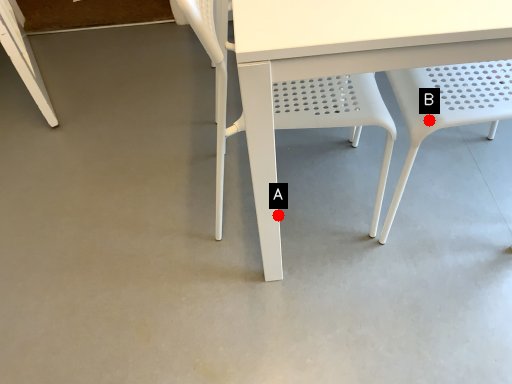
Question: Two points are circled on the image, labeled by A and B beside each circle. Among these points, which one is farthest from the camera?

Choices:
 (A) A is further
 (B) B is further

Answer: (A)